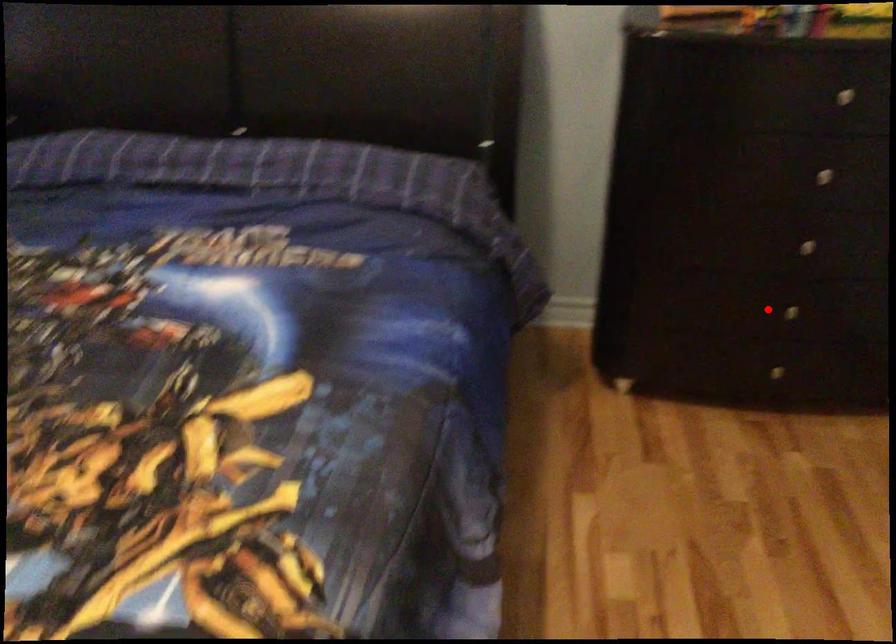
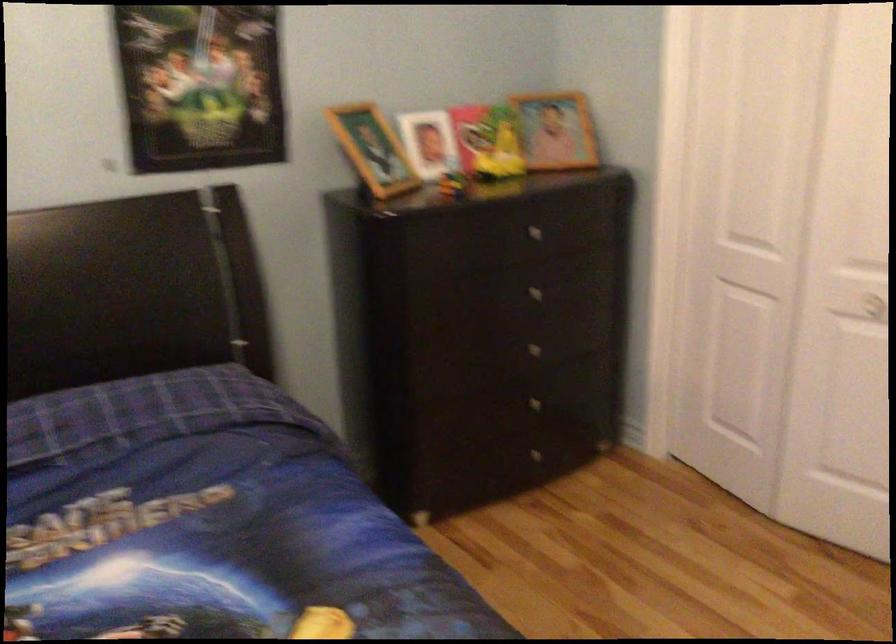
Question: I am providing you with two images of the same scene from different viewpoints. A red point is shown in image1. For the corresponding object point in image2, is it positioned nearer or farther from the camera?

Choices:
 (A) Nearer
 (B) Farther

Answer: (B)